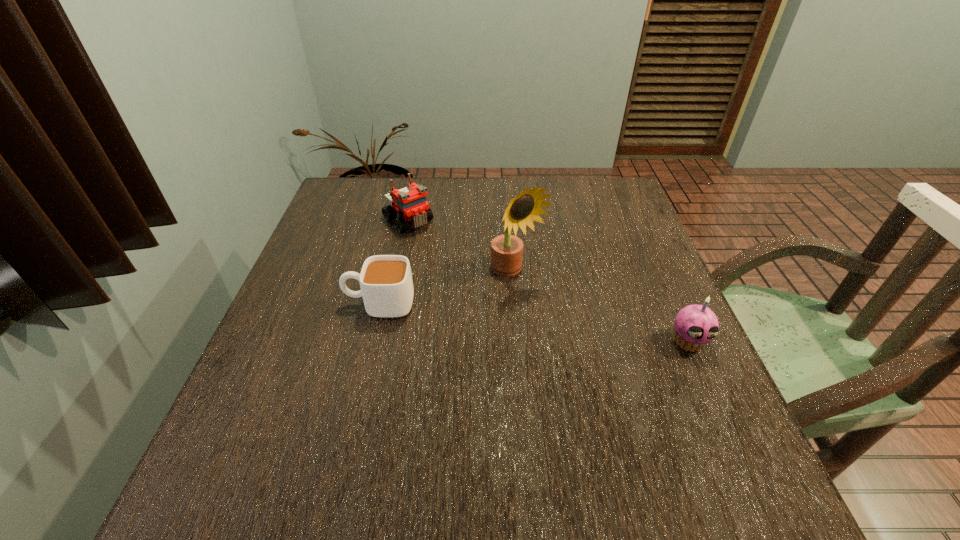
Locate an element on the screen. The height and width of the screenshot is (540, 960). vacant area that lies between the shortest object and the rightmost object is located at coordinates (534, 323).

You are a GUI agent. You are given a task and a screenshot of the screen. Output one action in this format:
    pyautogui.click(x=<x>, y=<y>)
    Task: Click on the empty location between the farthest object and the rightmost object
    Image resolution: width=960 pixels, height=540 pixels.
    Given the screenshot: What is the action you would take?
    pyautogui.click(x=548, y=281)

Identify the location of empty location between the Lego and the cupcake. This screenshot has height=540, width=960. (548, 281).

Locate an element on the screen. This screenshot has height=540, width=960. object that is the nearest to the cup is located at coordinates (506, 250).

Choose which object is the nearest neighbor to the cup. Please provide its 2D coordinates. Your answer should be formatted as a tuple, i.e. [(x, y)], where the tuple contains the x and y coordinates of a point satisfying the conditions above.

[(506, 250)]